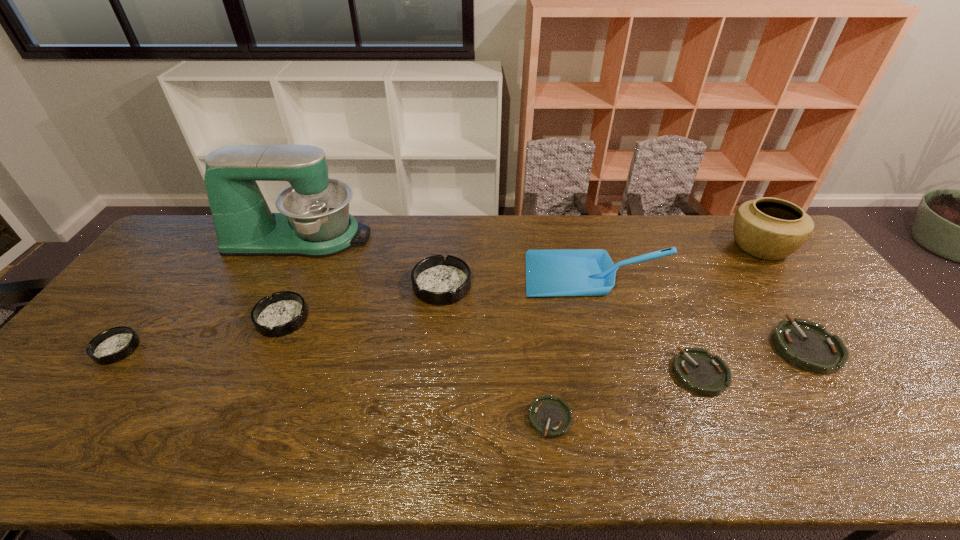
In order to click on the second closest dark ashtray to the second green ashtray from left to right in this screenshot , I will do `click(284, 312)`.

Identify which green ashtray is located as the third nearest to the seventh shortest object. Please provide its 2D coordinates. Your answer should be formatted as a tuple, i.e. [(x, y)], where the tuple contains the x and y coordinates of a point satisfying the conditions above.

[(551, 417)]

Point out which green ashtray is positioned as the nearest to the dustpan. Please provide its 2D coordinates. Your answer should be formatted as a tuple, i.e. [(x, y)], where the tuple contains the x and y coordinates of a point satisfying the conditions above.

[(696, 369)]

I want to click on vacant space that satisfies the following two spatial constraints: 1. on the back side of the smallest dark ashtray; 2. on the left side of the dustpan, so click(174, 275).

The image size is (960, 540). In order to click on vacant space that satisfies the following two spatial constraints: 1. on the front side of the fifth tallest ashtray; 2. on the left side of the leftmost object in this screenshot , I will do `click(98, 373)`.

Where is `free point that satisfies the following two spatial constraints: 1. on the front-facing side of the tallest object; 2. on the right side of the fourth tallest object`? The width and height of the screenshot is (960, 540). free point that satisfies the following two spatial constraints: 1. on the front-facing side of the tallest object; 2. on the right side of the fourth tallest object is located at coordinates (276, 285).

Image resolution: width=960 pixels, height=540 pixels. In order to click on free space in the image that satisfies the following two spatial constraints: 1. on the back side of the dustpan; 2. on the left side of the eighth shortest object in this screenshot , I will do `click(586, 247)`.

You are a GUI agent. You are given a task and a screenshot of the screen. Output one action in this format:
    pyautogui.click(x=<x>, y=<y>)
    Task: Click on the free location that satisfies the following two spatial constraints: 1. on the front side of the second smallest dark ashtray; 2. on the left side of the smallest green ashtray
    
    Given the screenshot: What is the action you would take?
    pyautogui.click(x=237, y=418)

The image size is (960, 540). I want to click on vacant space that satisfies the following two spatial constraints: 1. on the front-facing side of the sixth object from right to left; 2. on the right side of the tallest object, so click(x=276, y=285).

Find the location of a particular element. free spot that satisfies the following two spatial constraints: 1. on the back side of the second shortest object; 2. on the left side of the nearest ashtray is located at coordinates (544, 373).